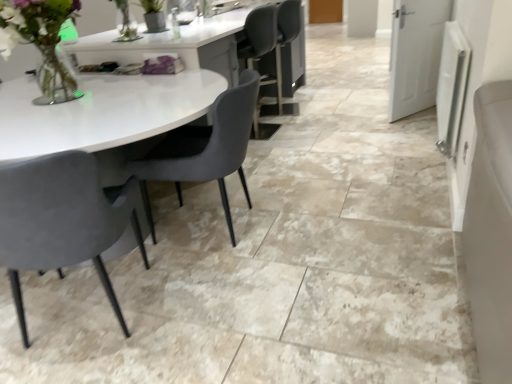
Find the location of `vacant space in matte gray chair at left, the second chair from the right (from a real-world perspective)`. vacant space in matte gray chair at left, the second chair from the right (from a real-world perspective) is located at coordinates (83, 317).